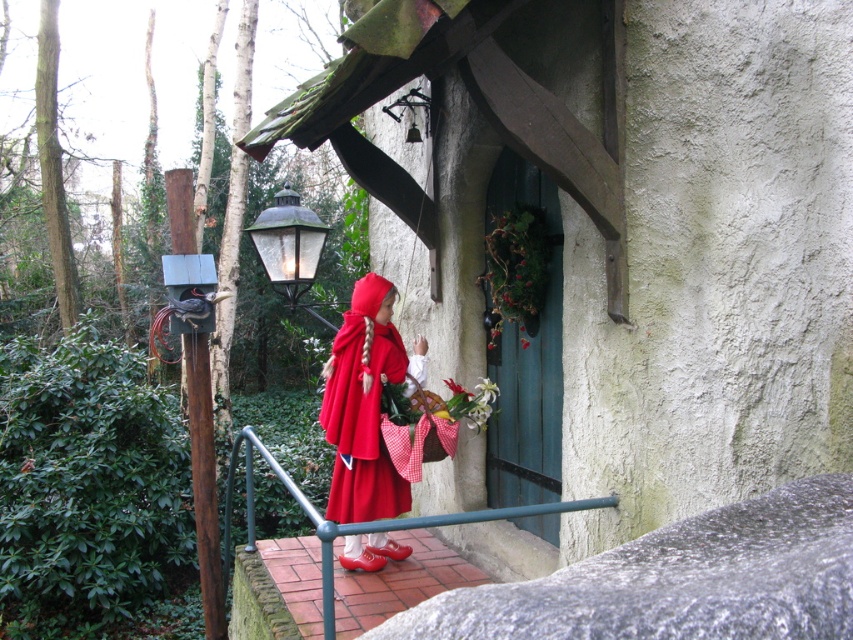
Question: Among these points, which one is nearest to the camera?

Choices:
 (A) (451, 400)
 (B) (379, 307)

Answer: (A)

Question: Observing the image, what is the correct spatial positioning of matte red cape at center in reference to white matte flower at center?

Choices:
 (A) left
 (B) right

Answer: (A)

Question: Does matte red cape at center appear on the left side of white matte flower at center?

Choices:
 (A) no
 (B) yes

Answer: (B)

Question: Which object appears closest to the camera in this image?

Choices:
 (A) matte red cape at center
 (B) white matte flower at center

Answer: (A)

Question: Can you confirm if matte red cape at center is positioned below white matte flower at center?

Choices:
 (A) no
 (B) yes

Answer: (A)